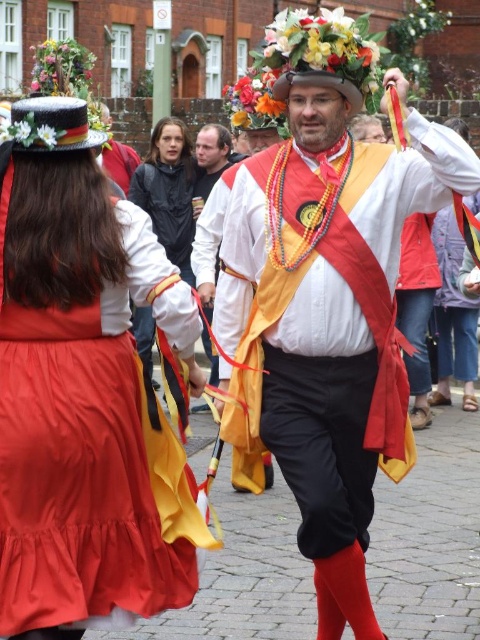
You are a photographer trying to capture a photo of the matte black hat at upper left and the matte black jacket at center. Based on their positions, which object should you focus on first to ensure both are in frame?

The matte black hat at upper left should be focused on first since it is positioned to the right of the matte black jacket at center, so adjusting the frame to include the rightmost object first ensures both are captured.

You are a photographer trying to capture both the matte black hat at upper left and the matte black jacket at center in a single frame. Which object should you focus on first to ensure both are in the frame?

The matte black hat at upper left is shorter than the matte black jacket at center. Focus on the matte black jacket at center first to ensure both objects are within the frame.

You are a photographer trying to capture the scene. You want to ensure that both the matte black hat at upper left and the matte white robe at center are visible in your shot. Based on their positions, which object should you focus on first to frame both properly?

The matte black hat at upper left is located below the matte white robe at center. To frame both properly, focus on the matte white robe at center first as it is higher up, ensuring the matte black hat at upper left below it remains in view.